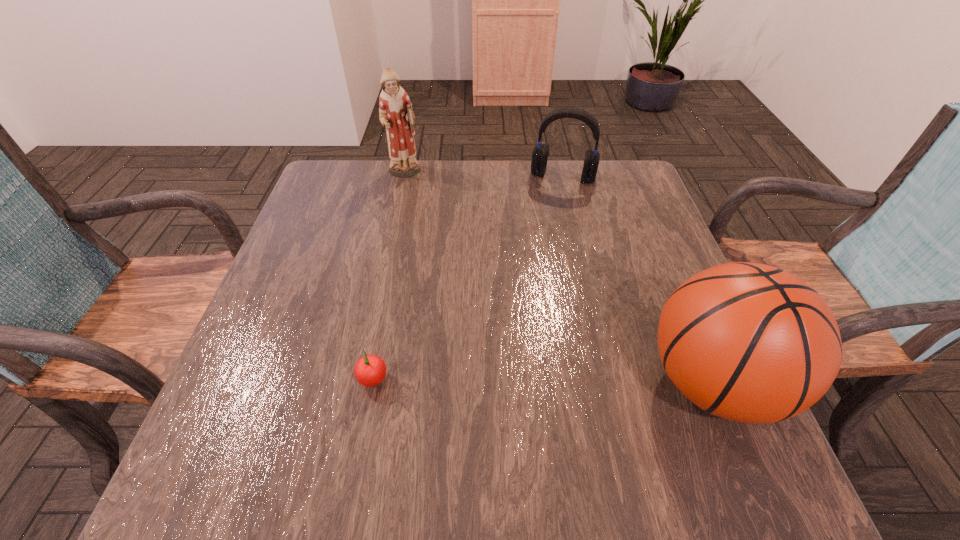
The width and height of the screenshot is (960, 540). In order to click on vacant space that satisfies the following two spatial constraints: 1. on the front side of the third tallest object; 2. on the left side of the figurine in this screenshot , I will do [x=404, y=176].